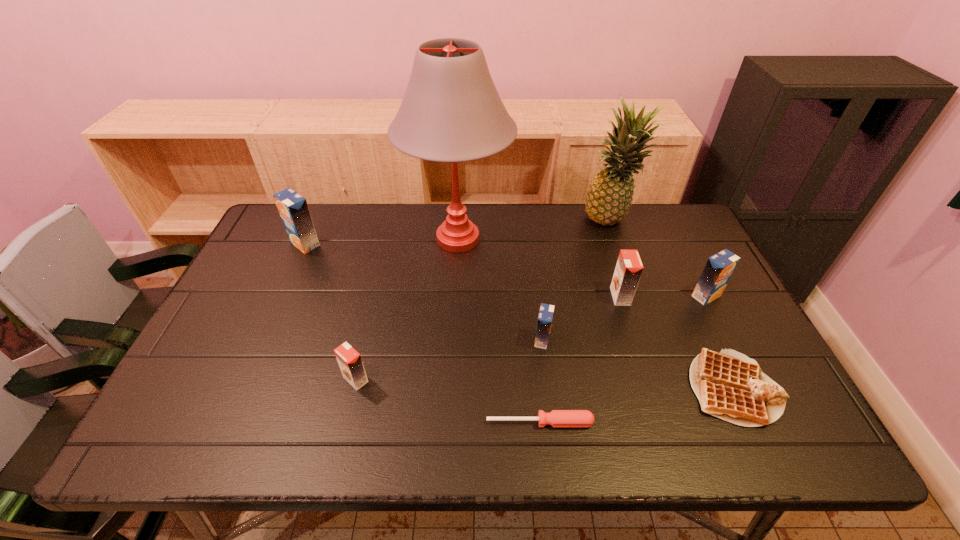
You are a GUI agent. You are given a task and a screenshot of the screen. Output one action in this format:
    pyautogui.click(x=<x>, y=<y>)
    Task: Click on the screwdriver present at the near edge
    
    Given the screenshot: What is the action you would take?
    pyautogui.click(x=556, y=418)

The width and height of the screenshot is (960, 540). In order to click on object located in the left edge section of the desktop in this screenshot , I will do pos(293,209).

Locate an element on the screen. This screenshot has height=540, width=960. orange_juice present at the right edge is located at coordinates (719, 268).

The height and width of the screenshot is (540, 960). In order to click on waffle at the right edge in this screenshot , I will do `click(729, 385)`.

Find the location of a particular element. object that is at the far left corner is located at coordinates (293, 209).

At what (x,y) coordinates should I click in order to perform the action: click on object at the near right corner. Please return your answer as a coordinate pair (x, y). This screenshot has height=540, width=960. Looking at the image, I should click on (729, 385).

Find the location of a particular element. vacant space at the far edge is located at coordinates pos(534,244).

The image size is (960, 540). Identify the location of free space at the near edge. (x=671, y=438).

Identify the location of vacant space at the left edge of the desktop. The width and height of the screenshot is (960, 540). (212, 334).

Image resolution: width=960 pixels, height=540 pixels. Identify the location of vacant space at the right edge. (700, 258).